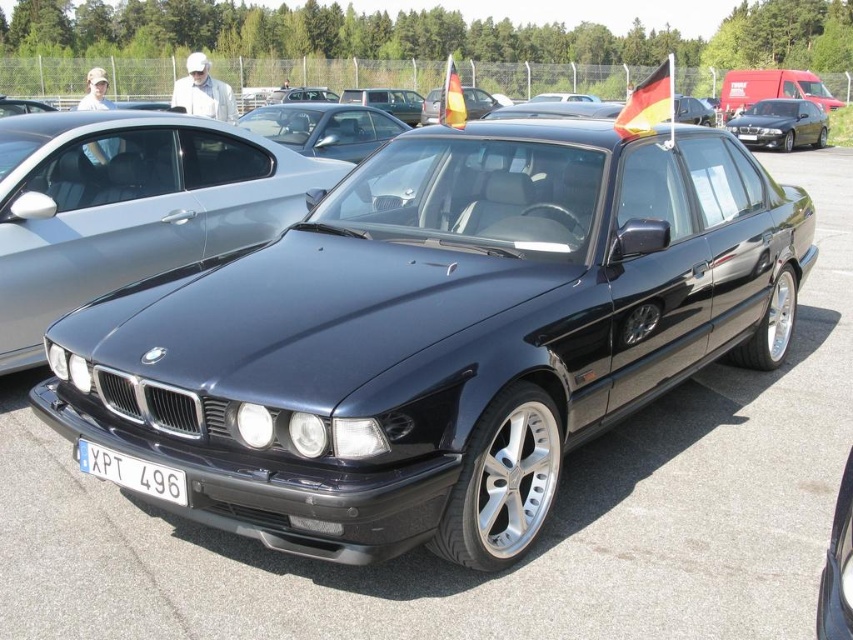
Question: Which object is farther from the camera taking this photo?

Choices:
 (A) satin black car at center
 (B) shiny black sedan at center
 (C) white plastic license plate at lower center
 (D) satin black sedan at center

Answer: (B)

Question: Does satin black sedan at center have a greater width compared to satin black car at center?

Choices:
 (A) no
 (B) yes

Answer: (B)

Question: Does satin black car at center appear on the left side of shiny black sedan at center?

Choices:
 (A) yes
 (B) no

Answer: (A)

Question: Which of the following is the farthest from the observer?

Choices:
 (A) pos(126,477)
 (B) pos(811,109)
 (C) pos(32,275)
 (D) pos(381,204)

Answer: (B)

Question: Does satin black car at center have a greater width compared to shiny black sedan at center?

Choices:
 (A) yes
 (B) no

Answer: (B)

Question: Which object is farther from the camera taking this photo?

Choices:
 (A) satin black car at center
 (B) satin black sedan at center
 (C) shiny black sedan at center
 (D) white plastic license plate at lower center

Answer: (C)